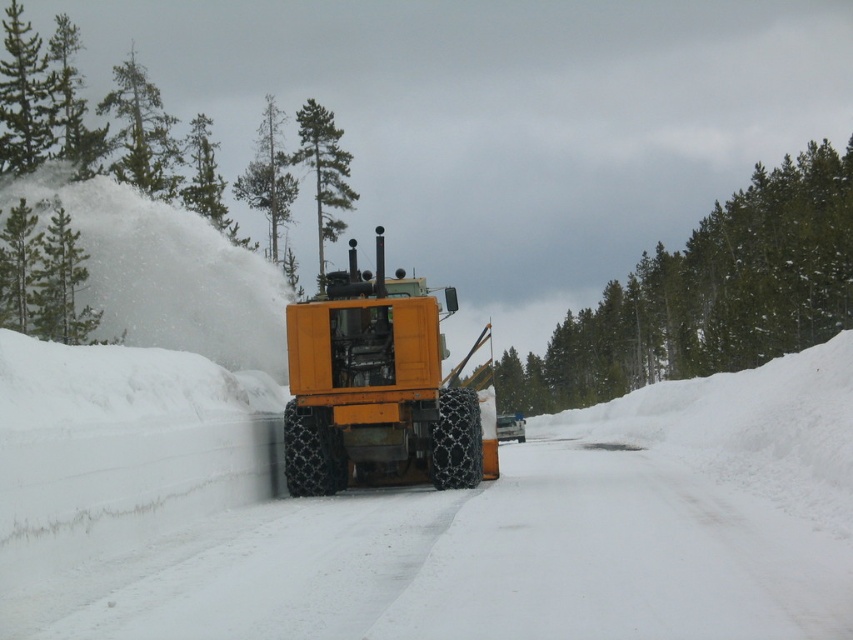
Question: Can you confirm if yellow rubber snowplow at center is bigger than orange rubber tractor at center?

Choices:
 (A) yes
 (B) no

Answer: (B)

Question: Which point is farther to the camera?

Choices:
 (A) orange rubber tractor at center
 (B) yellow rubber snowplow at center

Answer: (A)

Question: Which of the following is the closest to the observer?

Choices:
 (A) orange rubber tractor at center
 (B) yellow rubber snowplow at center

Answer: (B)

Question: Considering the relative positions of yellow rubber snowplow at center and orange rubber tractor at center in the image provided, where is yellow rubber snowplow at center located with respect to orange rubber tractor at center?

Choices:
 (A) left
 (B) right

Answer: (B)

Question: Does yellow rubber snowplow at center have a lesser width compared to orange rubber tractor at center?

Choices:
 (A) no
 (B) yes

Answer: (B)

Question: Which point is farther to the camera?

Choices:
 (A) orange rubber tractor at center
 (B) yellow rubber snowplow at center

Answer: (A)